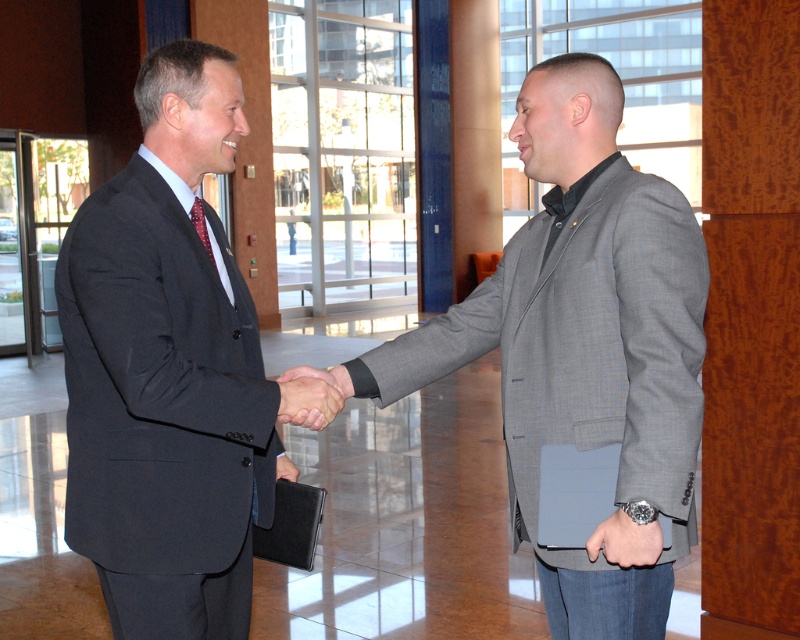
You are an event planner organizing a formal event and need to determine which of the two men in the image can fit through a narrow doorway that is 1.2 meters wide. The men are wearing the matte black suit at center and the gray textured blazer at center. Based on their attire, which one is more likely to pass through without difficulty?

The matte black suit at center is thinner than the gray textured blazer at center, so the man wearing the matte black suit at center is more likely to pass through the narrow doorway without difficulty.

You are a security guard standing at the entrance of the office lobby. You need to check the distance between the matte black suit at center and the gray textured blazer at center to ensure they are maintaining a safe social distance. The required distance is 36 inches. Can you confirm if they are following the guidelines?

The matte black suit at center is 30.12 inches away from gray textured blazer at center, which is less than the required 36 inches. They are not maintaining the safe social distance.